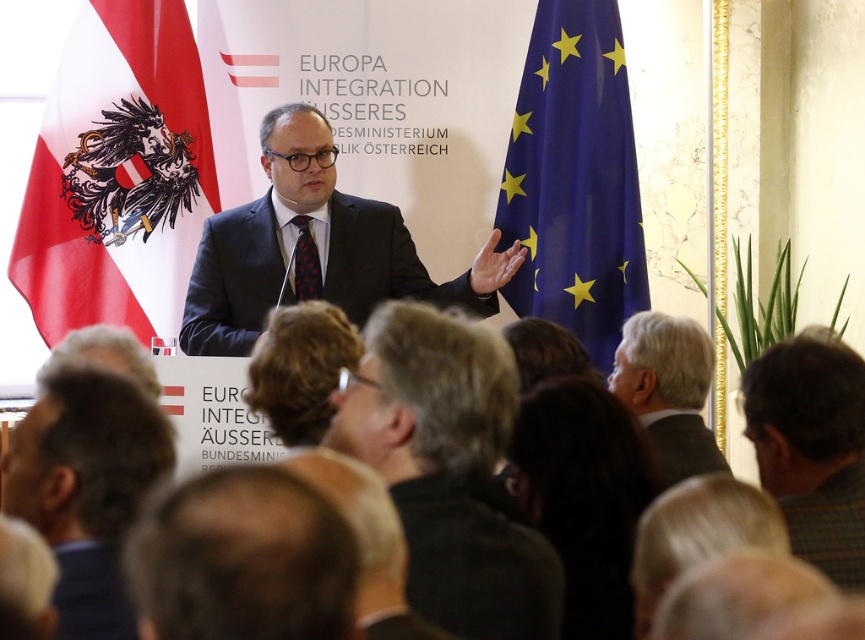
You are an event planner who needs to arrange seating for the attendees. You see the matte black suit at center and the gray suit at lower right. Which person should be seated closer to the front for better visibility?

The matte black suit at center should be seated closer to the front because they are much taller than the gray suit at lower right, which could block the view if seated in the same row.

You are an event organizer who needs to place a new banner between the red and white fabric flag at left and the dark gray suit at center. The banner requires a space of 3 meters. Is there enough space between them to accommodate the banner?

The distance between the red and white fabric flag at left and the dark gray suit at center is 3.19 meters, which is sufficient to place the banner requiring 3 meters of space.